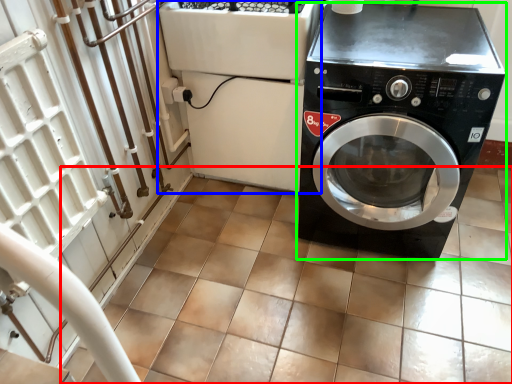
Question: Estimate the real-world distances between objects in this image. Which object is farther from tile (highlighted by a red box), appliance (highlighted by a blue box) or washing machine (highlighted by a green box)?

Choices:
 (A) appliance
 (B) washing machine

Answer: (A)